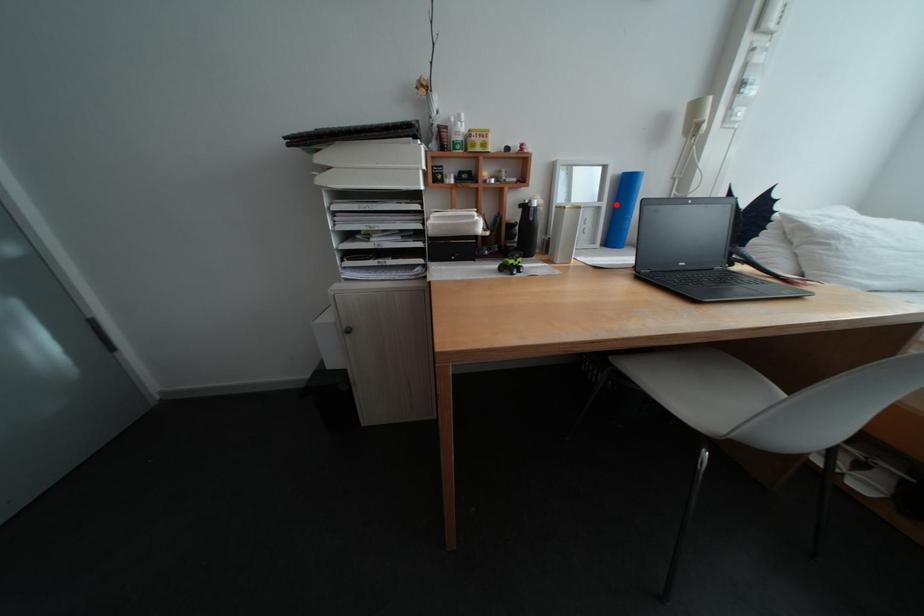
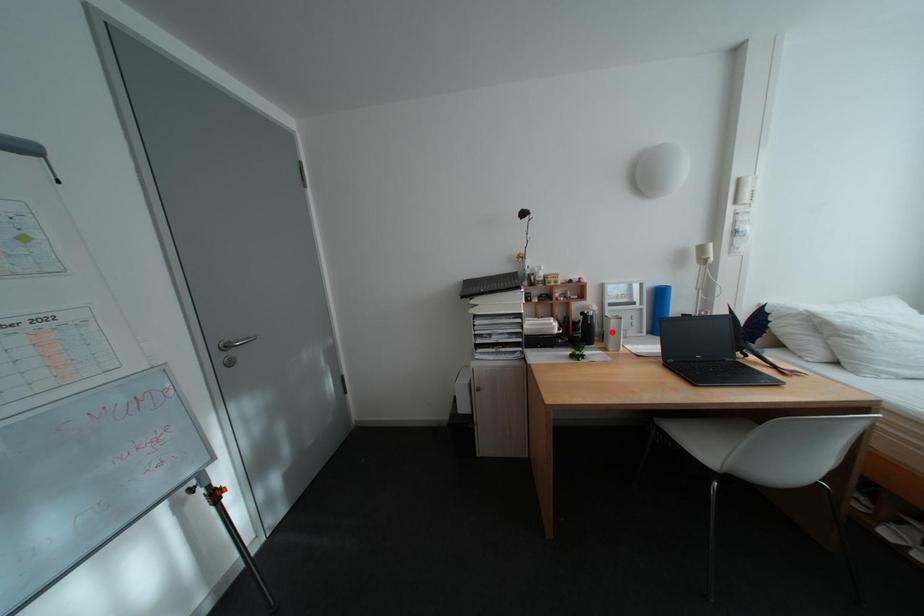
I am providing you with two images of the same scene from different viewpoints. A red point is marked on the first image and another point is marked on the second image. Are the points marked in image1 and image2 representing the same 3D position?

No